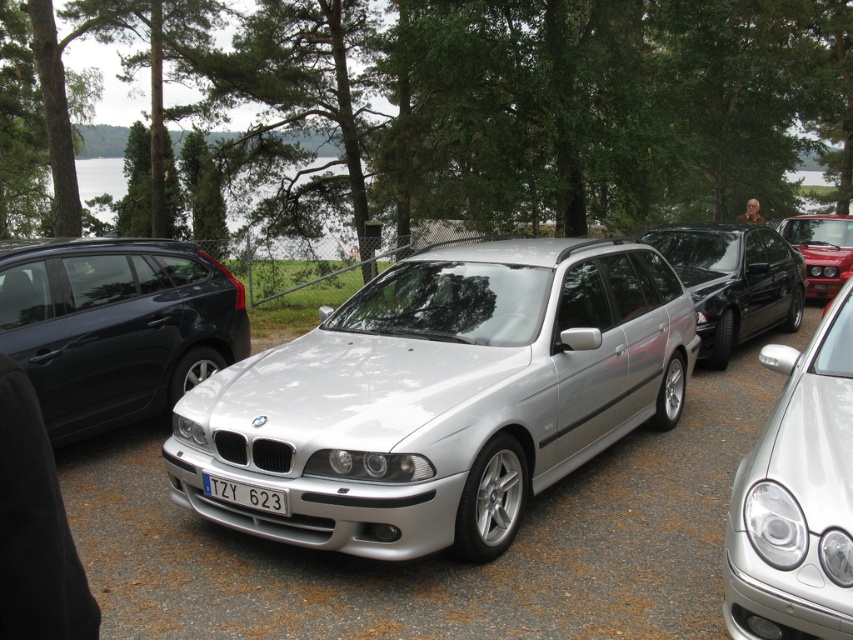
You are standing at the car meet and want to take a photo of the BMW E39 Touring station wagon. You notice two points marked in the image. The first point is at coordinates point (61, 364) and the second point is at coordinates point (786, 529). Which point is closer to your camera lens when taking the photo?

Point (61, 364) is closer to the camera lens than point (786, 529) because it is further to the camera.

You are a photographer wanting to capture both the matte black station wagon at left and the satin silver car at center in a single shot. Considering their heights, which car should you position closer to the camera to ensure both are fully visible in the frame?

The matte black station wagon at left is taller than the satin silver car at center. To ensure both are fully visible in the frame, position the taller matte black station wagon at left closer to the camera so its height doesn

You are standing in the parking area at the lakeside car meet. You want to take a photo of the silver metallic car at center from a distance where it will appear as large as possible in your camera frame. Considering your camera has a fixed focal length, which direction should you move to achieve this?

To make the silver metallic car at center appear as large as possible in your camera frame, you should move closer to it since it is currently 3.61 meters away from the viewer.